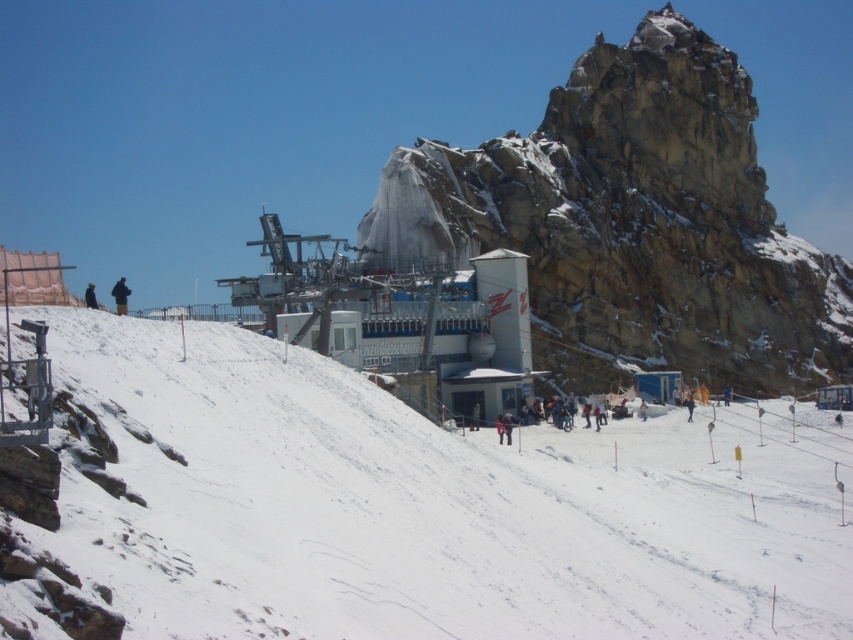
You are a photographer standing at the base of the ski lift station. You want to take a photo of the dark blue jacket at lower left and the white snow at lower left. Where should you position yourself to ensure both are in the frame?

Position yourself to the left of the dark blue jacket at lower left so that the white snow at lower left, which is to the right of the jacket, remains in view.